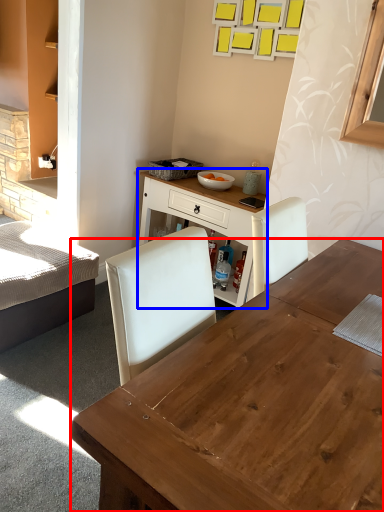
Question: Which of the following is the farthest to the observer, desk (highlighted by a red box) or table (highlighted by a blue box)?

Choices:
 (A) desk
 (B) table

Answer: (B)